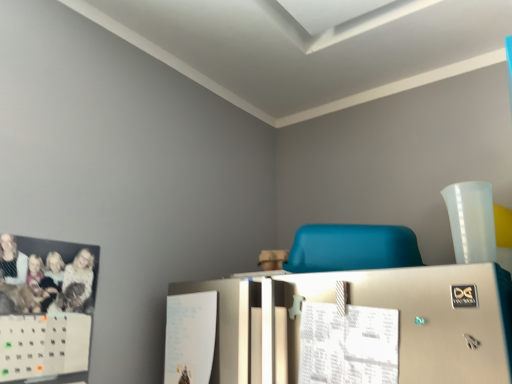
Question: From a real-world perspective, is blue matte chair at center located higher than white paper at center?

Choices:
 (A) no
 (B) yes

Answer: (B)

Question: Does blue matte chair at center have a lesser width compared to white paper at center?

Choices:
 (A) yes
 (B) no

Answer: (B)

Question: Does blue matte chair at center have a lesser height compared to white paper at center?

Choices:
 (A) no
 (B) yes

Answer: (B)

Question: Is blue matte chair at center further to camera compared to white paper at center?

Choices:
 (A) no
 (B) yes

Answer: (B)

Question: Can you confirm if blue matte chair at center is wider than white paper at center?

Choices:
 (A) yes
 (B) no

Answer: (A)

Question: Is blue matte chair at center positioned beyond the bounds of white paper at center?

Choices:
 (A) yes
 (B) no

Answer: (A)

Question: Considering the relative sizes of white paper at center and blue matte chair at center in the image provided, is white paper at center shorter than blue matte chair at center?

Choices:
 (A) yes
 (B) no

Answer: (B)

Question: From a real-world perspective, does white paper at center sit lower than blue matte chair at center?

Choices:
 (A) yes
 (B) no

Answer: (A)

Question: Can you confirm if white paper at center is taller than blue matte chair at center?

Choices:
 (A) no
 (B) yes

Answer: (B)

Question: Is white paper at center further to camera compared to blue matte chair at center?

Choices:
 (A) no
 (B) yes

Answer: (A)

Question: Considering the relative positions of white paper at center and blue matte chair at center in the image provided, is white paper at center to the left of blue matte chair at center from the viewer's perspective?

Choices:
 (A) no
 (B) yes

Answer: (B)

Question: Considering the relative positions of white paper at center and blue matte chair at center in the image provided, is white paper at center to the right of blue matte chair at center from the viewer's perspective?

Choices:
 (A) yes
 (B) no

Answer: (B)

Question: In terms of width, does blue matte chair at center look wider or thinner when compared to white paper at center?

Choices:
 (A) wide
 (B) thin

Answer: (A)